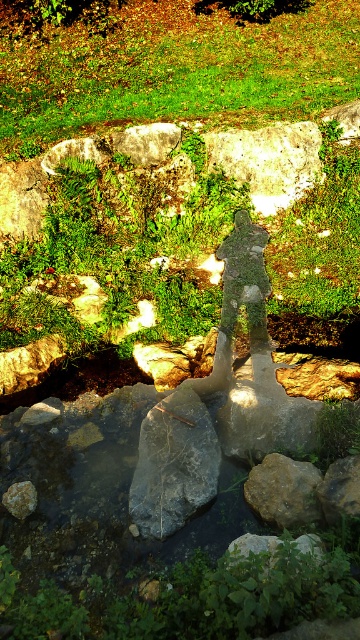
Which is in front, point (316, 280) or point (20, 484)?

Point (20, 484) is more forward.

Who is lower down, green leafy grass at center or smooth gray rock at lower left?

smooth gray rock at lower left is below.

Identify the location of green leafy grass at center. (182, 220).

Does rough textured rock at center lie behind smooth gray rock at lower left?

No, rough textured rock at center is in front of smooth gray rock at lower left.

Is point (325, 502) closer to viewer compared to point (9, 504)?

Yes, it is.

Find the location of a particular element. rough textured rock at center is located at coordinates (339, 488).

Measure the distance between green grass at upper center and smooth gray rock at lower left.

They are 7.44 meters apart.

Who is more distant from viewer, (2, 152) or (24, 486)?

The point (2, 152) is behind.

I want to click on green grass at upper center, so click(176, 70).